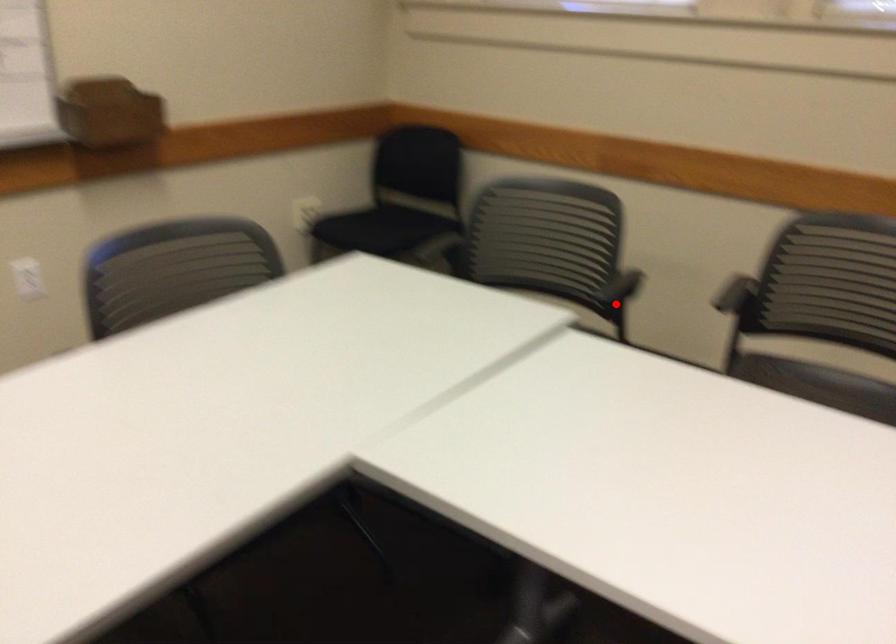
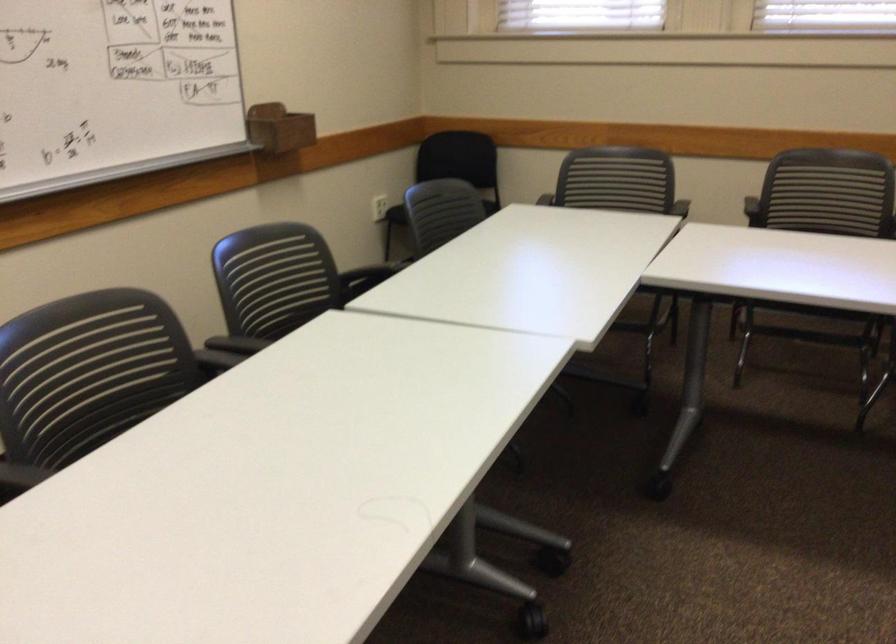
Question: A red point is marked in image1. In image2, is the corresponding 3D point closer to the camera or farther? Reply with the corresponding letter.

Choices:
 (A) The corresponding 3D point is closer.
 (B) The corresponding 3D point is farther.

Answer: (B)